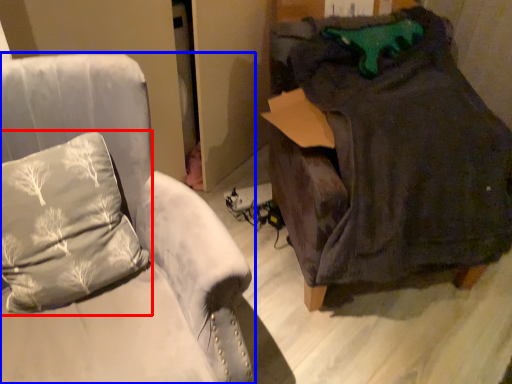
Question: Among these objects, which one is nearest to the camera, pillow (highlighted by a red box) or furniture (highlighted by a blue box)?

Choices:
 (A) pillow
 (B) furniture

Answer: (B)